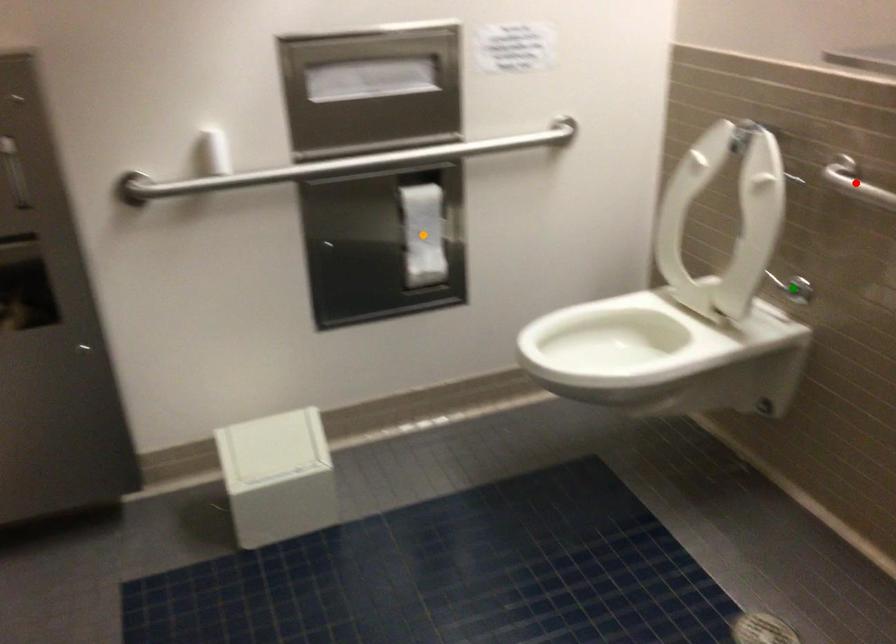
Order these from nearest to farthest:
A) orange point
B) red point
C) green point

red point
green point
orange point